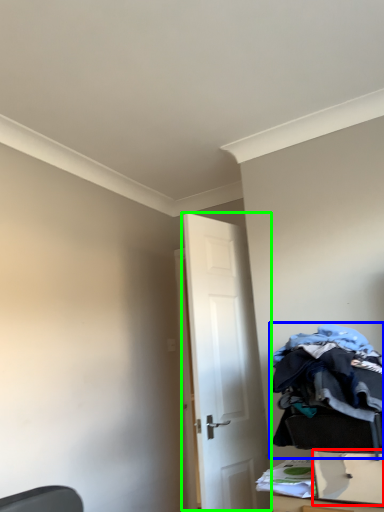
Question: Considering the real-world distances, which object is closest to drawer (highlighted by a red box)? laundry (highlighted by a blue box) or door (highlighted by a green box).

Choices:
 (A) laundry
 (B) door

Answer: (A)